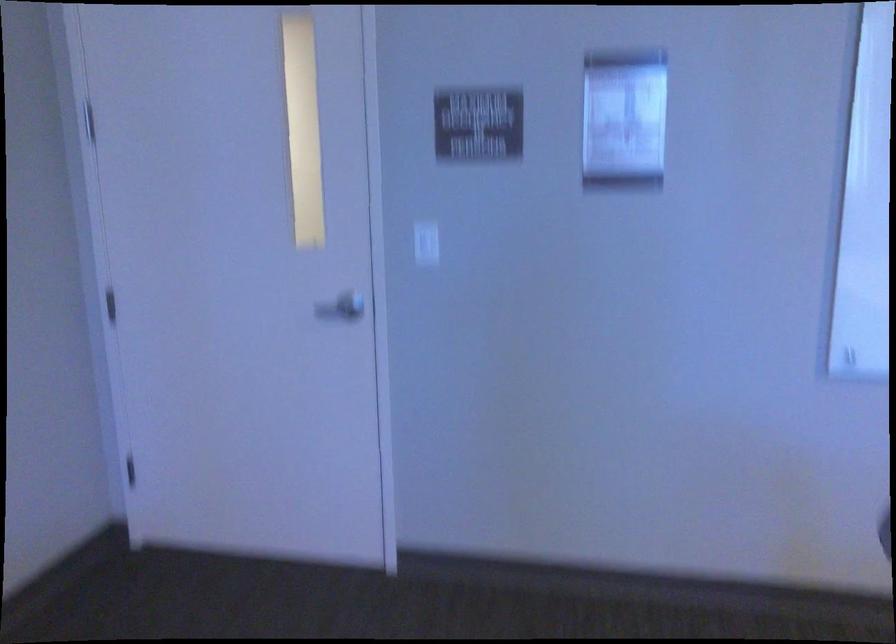
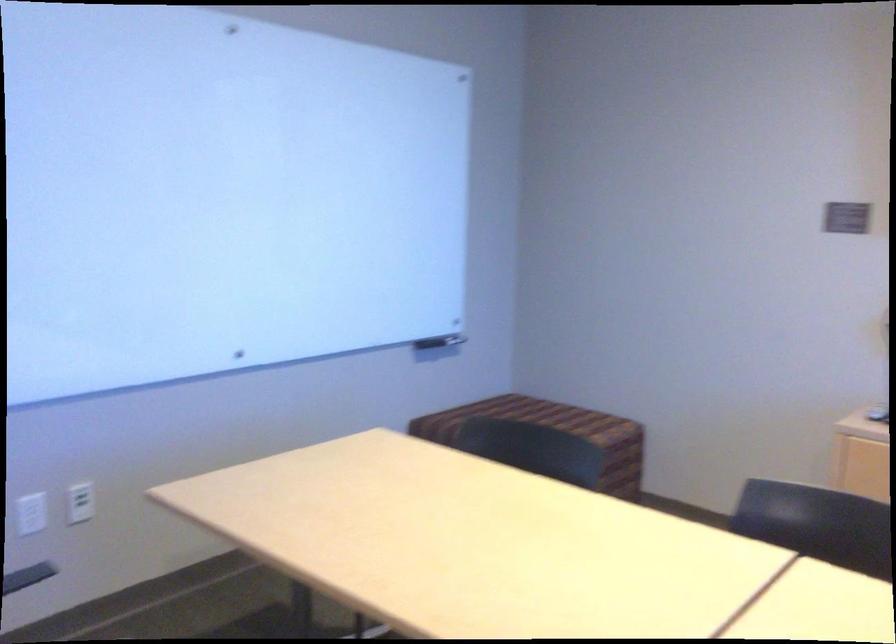
Question: How did the camera likely rotate?

Choices:
 (A) Left
 (B) Right
 (C) Up
 (D) Down

Answer: (B)